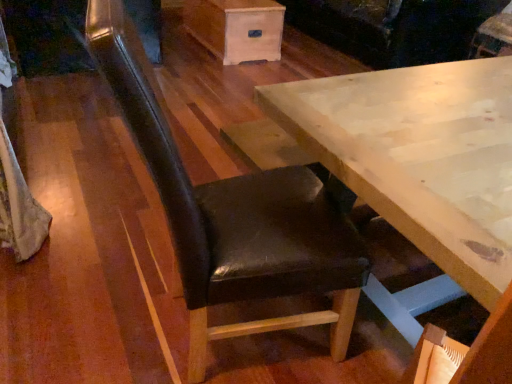
The width and height of the screenshot is (512, 384). What are the coordinates of `black leather chair at center` in the screenshot? It's located at (232, 214).

What do you see at coordinates (232, 214) in the screenshot? I see `black leather chair at center` at bounding box center [232, 214].

Image resolution: width=512 pixels, height=384 pixels. I want to click on velvet dark brown couch at upper center, so click(393, 28).

Image resolution: width=512 pixels, height=384 pixels. Find the location of `wooden drawer at upper center`. wooden drawer at upper center is located at coordinates (236, 28).

From a real-world perspective, does light wood table at center stand above wooden drawer at upper center?

Yes.

Is wooden drawer at upper center at the back of light wood table at center?

light wood table at center is not turned away from wooden drawer at upper center.

Considering the relative sizes of light wood table at center and wooden drawer at upper center in the image provided, is light wood table at center thinner than wooden drawer at upper center?

No, light wood table at center is not thinner than wooden drawer at upper center.

Looking at this image, which point is more distant from viewer, (375, 74) or (249, 42)?

The point (249, 42) is farther from the camera.

Could you tell me if velvet dark brown couch at upper center is turned towards black leather chair at center?

No, velvet dark brown couch at upper center is not oriented towards black leather chair at center.

Is velvet dark brown couch at upper center thinner than black leather chair at center?

Incorrect, the width of velvet dark brown couch at upper center is not less than that of black leather chair at center.

Is velvet dark brown couch at upper center not close to black leather chair at center?

Yes.

Considering the sizes of objects velvet dark brown couch at upper center and black leather chair at center in the image provided, who is bigger, velvet dark brown couch at upper center or black leather chair at center?

Bigger between the two is velvet dark brown couch at upper center.

Do you think velvet dark brown couch at upper center is within wooden drawer at upper center, or outside of it?

velvet dark brown couch at upper center cannot be found inside wooden drawer at upper center.

Can you confirm if velvet dark brown couch at upper center is thinner than wooden drawer at upper center?

No, velvet dark brown couch at upper center is not thinner than wooden drawer at upper center.

From a real-world perspective, is velvet dark brown couch at upper center below wooden drawer at upper center?

No.

Is velvet dark brown couch at upper center in front of or behind wooden drawer at upper center in the image?

In the image, velvet dark brown couch at upper center appears in front of wooden drawer at upper center.

Which is in front, black leather chair at center or wooden drawer at upper center?

black leather chair at center is in front.

Can you confirm if black leather chair at center is thinner than wooden drawer at upper center?

In fact, black leather chair at center might be wider than wooden drawer at upper center.

Does black leather chair at center touch wooden drawer at upper center?

No, black leather chair at center is not touching wooden drawer at upper center.

From a real-world perspective, between black leather chair at center and wooden drawer at upper center, who is vertically higher?

From a 3D spatial view, black leather chair at center is above.

From the image's perspective, is wooden drawer at upper center positioned above or below light wood table at center?

Based on their image positions, wooden drawer at upper center is located above light wood table at center.

How far apart are wooden drawer at upper center and light wood table at center?

wooden drawer at upper center is 8.58 feet away from light wood table at center.

In the scene shown: Which is more to the right, wooden drawer at upper center or light wood table at center?

From the viewer's perspective, light wood table at center appears more on the right side.

What's the angular difference between wooden drawer at upper center and light wood table at center's facing directions?

wooden drawer at upper center and light wood table at center are facing 91.8 degrees away from each other.

In the scene shown: Considering the sizes of objects light wood table at center and black leather chair at center in the image provided, who is bigger, light wood table at center or black leather chair at center?

With larger size is light wood table at center.

Which is more to the right, light wood table at center or black leather chair at center?

light wood table at center.

Looking at this image, can you tell me how much light wood table at center and black leather chair at center differ in facing direction?

The facing directions of light wood table at center and black leather chair at center are 91.9 degrees apart.

Which of these two, black leather chair at center or light wood table at center, is wider?

Wider between the two is light wood table at center.

From a real-world perspective, which is physically below, black leather chair at center or light wood table at center?

In real-world perspective, light wood table at center is lower.

From the image's perspective, does black leather chair at center appear higher than light wood table at center?

Yes, from the image's perspective, black leather chair at center is over light wood table at center.

Where is `table below the wooden drawer at upper center (from the image's perspective)`? The height and width of the screenshot is (384, 512). table below the wooden drawer at upper center (from the image's perspective) is located at coordinates (419, 167).

The image size is (512, 384). In order to click on couch that appears above the black leather chair at center (from the image's perspective) in this screenshot , I will do `click(393, 28)`.

Based on the photo, based on their spatial positions, is velvet dark brown couch at upper center or light wood table at center closer to black leather chair at center?

light wood table at center.

Based on their spatial positions, is velvet dark brown couch at upper center or wooden drawer at upper center closer to light wood table at center?

The object closer to light wood table at center is velvet dark brown couch at upper center.

Which object lies nearer to the anchor point light wood table at center, black leather chair at center or velvet dark brown couch at upper center?

The object closer to light wood table at center is black leather chair at center.

When comparing their distances from velvet dark brown couch at upper center, does wooden drawer at upper center or black leather chair at center seem further?

black leather chair at center lies further to velvet dark brown couch at upper center than the other object.

Which object lies further to the anchor point black leather chair at center, velvet dark brown couch at upper center or wooden drawer at upper center?

velvet dark brown couch at upper center.

Considering their positions, is black leather chair at center positioned closer to light wood table at center than wooden drawer at upper center?

black leather chair at center is positioned closer to the anchor light wood table at center.

Looking at the image, which one is located further to velvet dark brown couch at upper center, wooden drawer at upper center or light wood table at center?

light wood table at center.

Looking at the image, which one is located closer to black leather chair at center, light wood table at center or velvet dark brown couch at upper center?

light wood table at center.

Identify the location of table between black leather chair at center and wooden drawer at upper center along the z-axis. This screenshot has height=384, width=512. (419, 167).

Identify the location of couch between light wood table at center and wooden drawer at upper center from front to back. The height and width of the screenshot is (384, 512). (393, 28).

Identify the location of table located between black leather chair at center and velvet dark brown couch at upper center in the depth direction. This screenshot has width=512, height=384. (419, 167).

This screenshot has height=384, width=512. In order to click on couch between black leather chair at center and wooden drawer at upper center from front to back in this screenshot , I will do `click(393, 28)`.